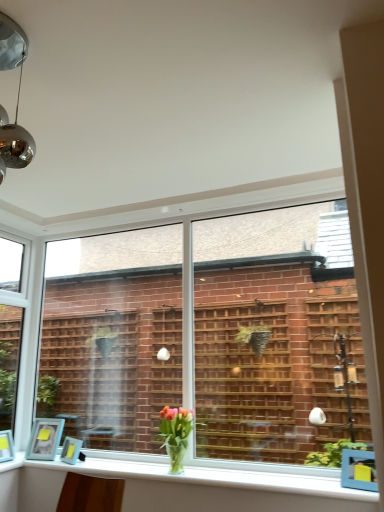
Question: Which direction should I rotate to face clear glass window at center, which appears as the 1th window when viewed from the right, — up or down?

Choices:
 (A) down
 (B) up

Answer: (A)

Question: Is white glossy window sill at lower center at the left side of matte blue picture frame at lower left, positioned as the second picture frame in right-to-left order?

Choices:
 (A) yes
 (B) no

Answer: (B)

Question: Considering the relative sizes of white glossy window sill at lower center and matte blue picture frame at lower left, which is the 1th picture frame in left-to-right order, in the image provided, is white glossy window sill at lower center wider than matte blue picture frame at lower left, which is the 1th picture frame in left-to-right order,?

Choices:
 (A) no
 (B) yes

Answer: (B)

Question: From the image's perspective, would you say white glossy window sill at lower center is shown under matte blue picture frame at lower left, which is the 1th picture frame in left-to-right order?

Choices:
 (A) yes
 (B) no

Answer: (A)

Question: Can matte blue picture frame at lower left, which is the 1th picture frame in left-to-right order, be found inside white glossy window sill at lower center?

Choices:
 (A) no
 (B) yes

Answer: (A)

Question: Considering the relative positions of white glossy window sill at lower center and matte blue picture frame at lower left, which is the 1th picture frame in left-to-right order, in the image provided, is white glossy window sill at lower center behind matte blue picture frame at lower left, which is the 1th picture frame in left-to-right order,?

Choices:
 (A) yes
 (B) no

Answer: (B)

Question: Considering the relative positions of white glossy window sill at lower center and matte blue picture frame at lower left, positioned as the second picture frame in right-to-left order, in the image provided, is white glossy window sill at lower center in front of matte blue picture frame at lower left, positioned as the second picture frame in right-to-left order,?

Choices:
 (A) no
 (B) yes

Answer: (B)

Question: Does matte blue picture frame at lower left, positioned as the 1th picture frame in right-to-left order, have a greater height compared to translucent glass vase at lower center?

Choices:
 (A) no
 (B) yes

Answer: (A)

Question: Does matte blue picture frame at lower left, positioned as the 1th picture frame in right-to-left order, have a greater width compared to translucent glass vase at lower center?

Choices:
 (A) no
 (B) yes

Answer: (A)

Question: Is matte blue picture frame at lower left, positioned as the 1th picture frame in right-to-left order, to the right of translucent glass vase at lower center from the viewer's perspective?

Choices:
 (A) no
 (B) yes

Answer: (A)

Question: Is matte blue picture frame at lower left, the 2th picture frame when ordered from left to right, positioned in front of translucent glass vase at lower center?

Choices:
 (A) yes
 (B) no

Answer: (B)

Question: Does matte blue picture frame at lower left, positioned as the 1th picture frame in right-to-left order, come behind translucent glass vase at lower center?

Choices:
 (A) yes
 (B) no

Answer: (A)

Question: Considering the relative sizes of matte blue picture frame at lower left, the 2th picture frame when ordered from left to right, and translucent glass vase at lower center in the image provided, is matte blue picture frame at lower left, the 2th picture frame when ordered from left to right, shorter than translucent glass vase at lower center?

Choices:
 (A) yes
 (B) no

Answer: (A)

Question: Can you confirm if matte blue picture frame at lower left, positioned as the second picture frame in right-to-left order, is positioned to the left of clear glass window at left, which is the 1th window from left to right?

Choices:
 (A) no
 (B) yes

Answer: (A)